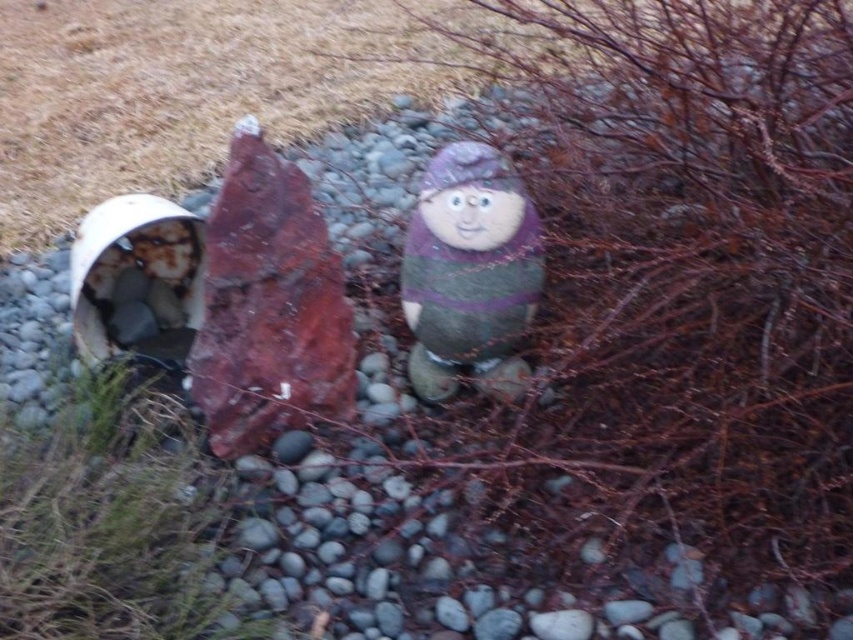
You are a gardener who wants to place a new plant pot between the green grass at lower left and the matte painted stone figure at center. The pot requires at least 24 inches of space between them. Do you think there is enough space?

The green grass at lower left is 23.67 inches from matte painted stone figure at center. Since the required space is 24 inches, there is insufficient space to place the plant pot between them.

You are a gardener looking to plant a new flower bed. You notice the green grass at lower left and the matte painted stone figure at center. Which object is positioned lower in the scene?

The green grass at lower left is below matte painted stone figure at center, so the green grass at lower left is positioned lower in the scene.